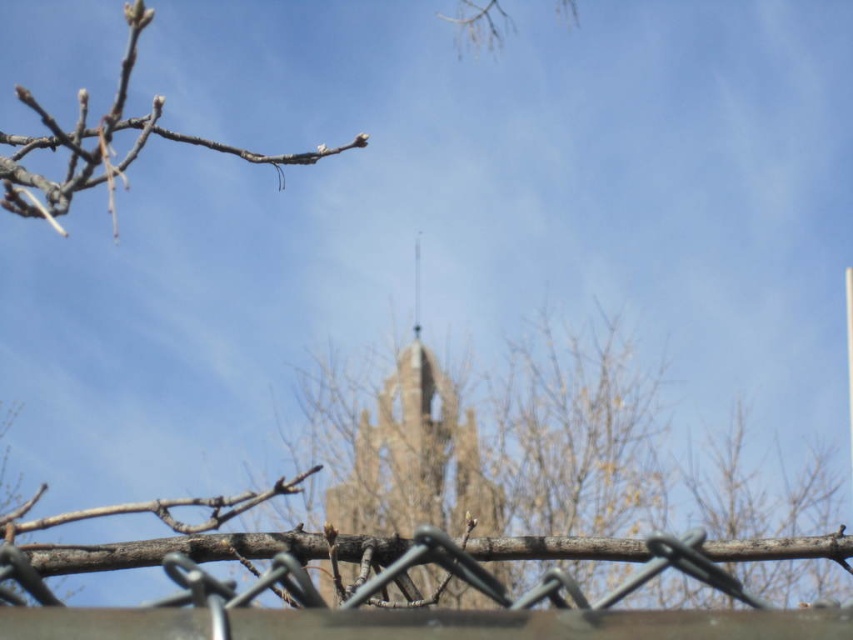
You are a photographer trying to capture the tower in the background. You notice the metallic wire fence at lower center and the bare wood branch at upper left might block your view. Which object is taller and could potentially block more of the tower?

The bare wood branch at upper left is taller than the metallic wire fence at lower center, so it could potentially block more of the tower.

Looking at this image, you are standing at the center of the image and want to walk towards the metallic wire fence at lower center. Which direction should you move to reach it?

Since the metallic wire fence at lower center is located at point (x=534, y=624), you should move downward and to the right from the center to reach it.